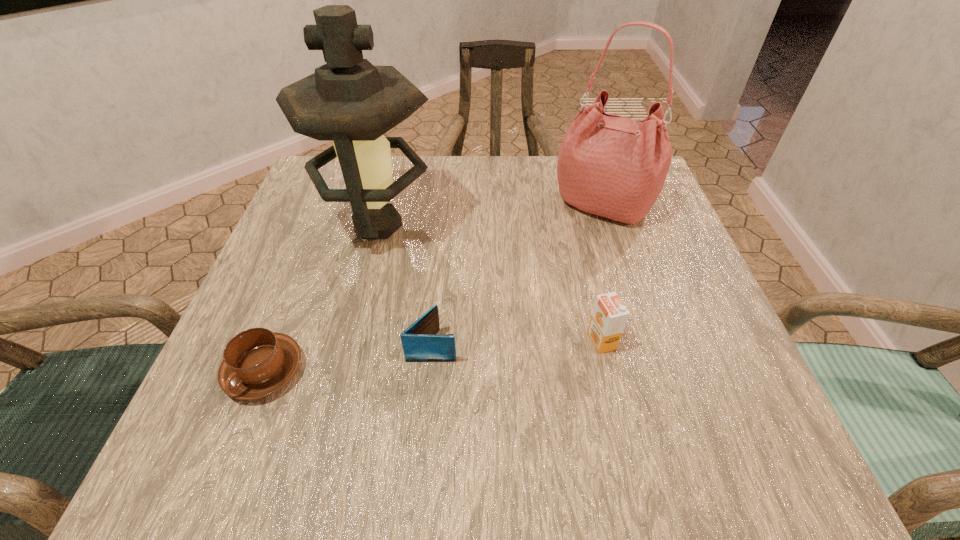
Locate an element on the screen. The image size is (960, 540). oil lamp is located at coordinates (349, 101).

Where is `handbag`? This screenshot has width=960, height=540. handbag is located at coordinates (612, 166).

Image resolution: width=960 pixels, height=540 pixels. Identify the location of orange juice. (609, 316).

Image resolution: width=960 pixels, height=540 pixels. Identify the location of wallet. (420, 343).

You are a GUI agent. You are given a task and a screenshot of the screen. Output one action in this format:
    pyautogui.click(x=<x>, y=<y>)
    Task: Click on the cappuccino
    
    Given the screenshot: What is the action you would take?
    pyautogui.click(x=257, y=362)

Image resolution: width=960 pixels, height=540 pixels. What are the coordinates of `free space located 0.280m on the front of the oil lamp` in the screenshot? It's located at (337, 390).

Locate an element on the screen. The height and width of the screenshot is (540, 960). vacant area situated 0.180m on the left of the handbag is located at coordinates (473, 205).

Locate an element on the screen. free space located 0.300m on the back of the orange juice is located at coordinates [573, 218].

The image size is (960, 540). In order to click on free point located 0.160m on the exterior surface of the wallet in this screenshot , I will do `click(554, 345)`.

The height and width of the screenshot is (540, 960). I want to click on oil lamp situated at the far edge, so click(x=349, y=101).